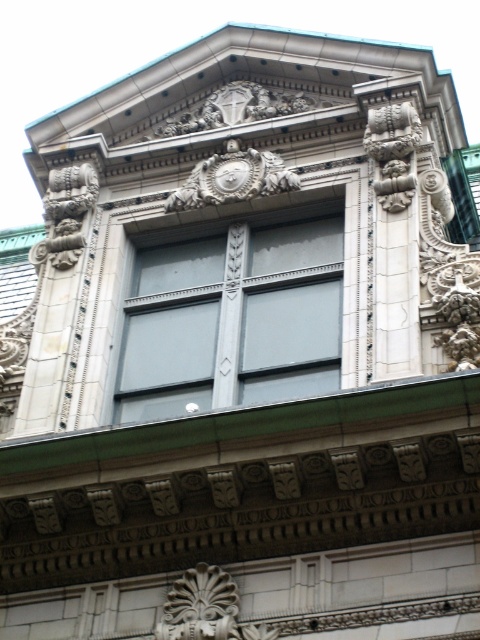
You are an architect reviewing the building facade. You need to determine which object, the matte gray glass window at center or the carved stone ornament at center, would require more material for a replica. Based on their sizes, which one would need more material?

The matte gray glass window at center is larger in size than the carved stone ornament at center, so the matte gray glass window at center would require more material for a replica.

You are standing directly in front of the building facade. Where would you look to see the matte gray glass window at center?

The matte gray glass window at center is located at the center of the building facade, so you should look straight ahead to see it.